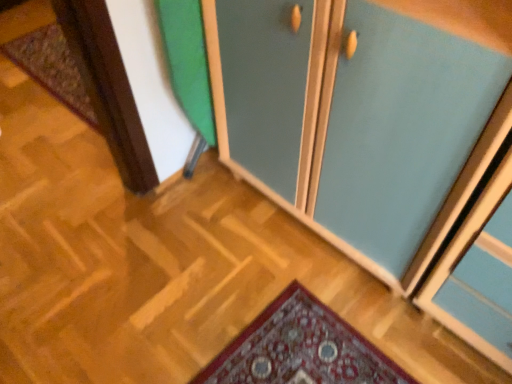
Find the location of `free spot above carpeted mat at left (from a real-world perspective)`. free spot above carpeted mat at left (from a real-world perspective) is located at coordinates (47, 54).